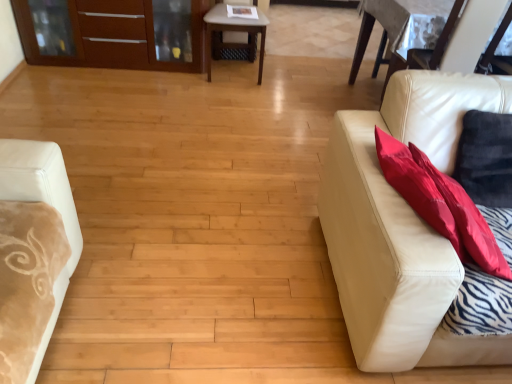
This screenshot has width=512, height=384. In order to click on vacant area to the left of leather couch at right in this screenshot , I will do `click(230, 254)`.